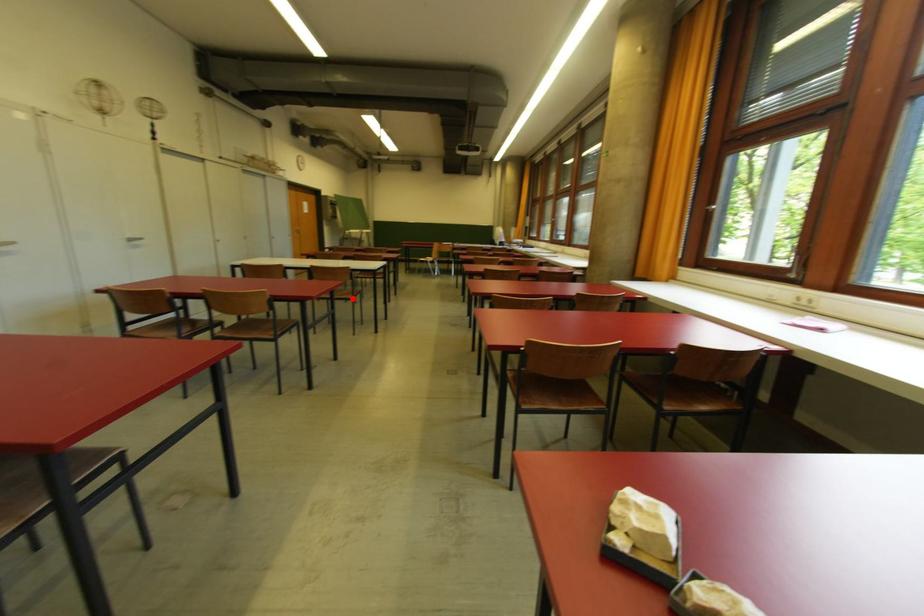
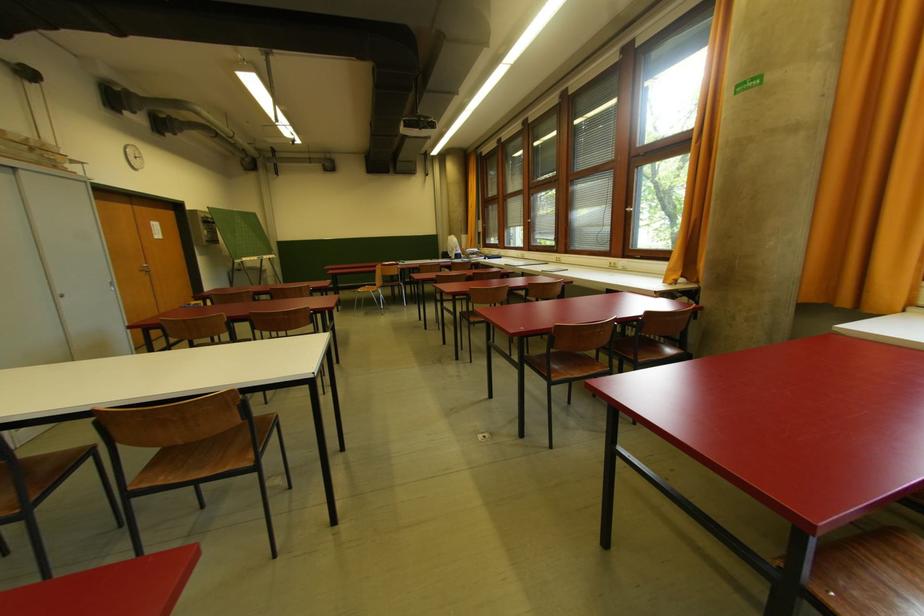
Question: I am providing you with two images of the same scene from different viewpoints. In image1, a red point is highlighted. Considering the same 3D point in image2, which of the following is correct?

Choices:
 (A) It is closer
 (B) It is farther

Answer: (B)